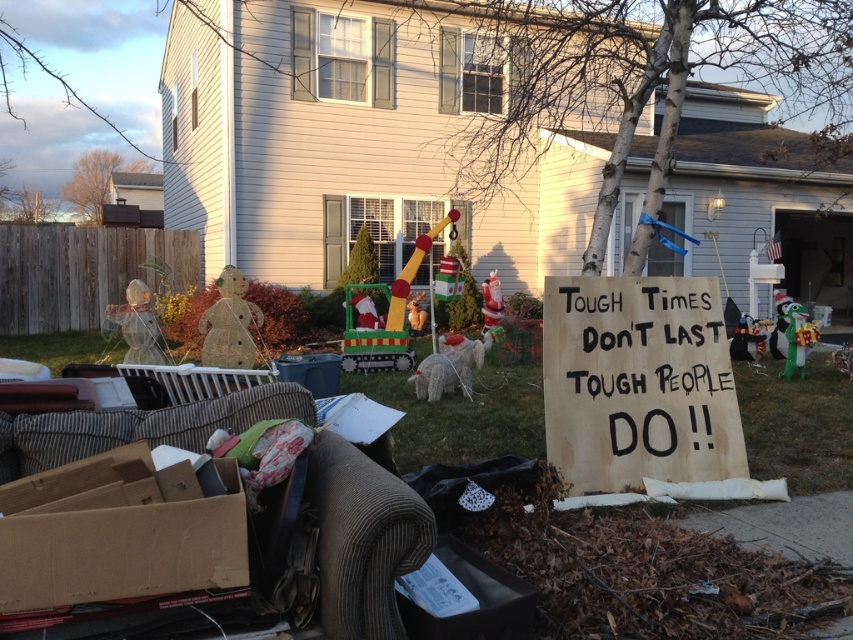
Question: Among these objects, which one is nearest to the camera?

Choices:
 (A) brown cardboard sign at center
 (B) brown cardboard box at lower left

Answer: (B)

Question: Does brown cardboard sign at center appear on the left side of brown cardboard box at lower left?

Choices:
 (A) yes
 (B) no

Answer: (B)

Question: Observing the image, what is the correct spatial positioning of brown cardboard sign at center in reference to brown cardboard box at lower left?

Choices:
 (A) below
 (B) above

Answer: (B)

Question: Is brown cardboard sign at center below brown cardboard box at lower left?

Choices:
 (A) yes
 (B) no

Answer: (B)

Question: Which point is farther from the camera taking this photo?

Choices:
 (A) (x=10, y=602)
 (B) (x=677, y=426)

Answer: (B)